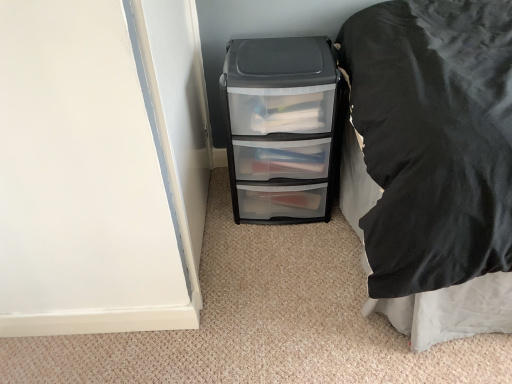
Where is `free space above transparent plastic file cabinet at center (from a real-world perspective)`? free space above transparent plastic file cabinet at center (from a real-world perspective) is located at coordinates (280, 49).